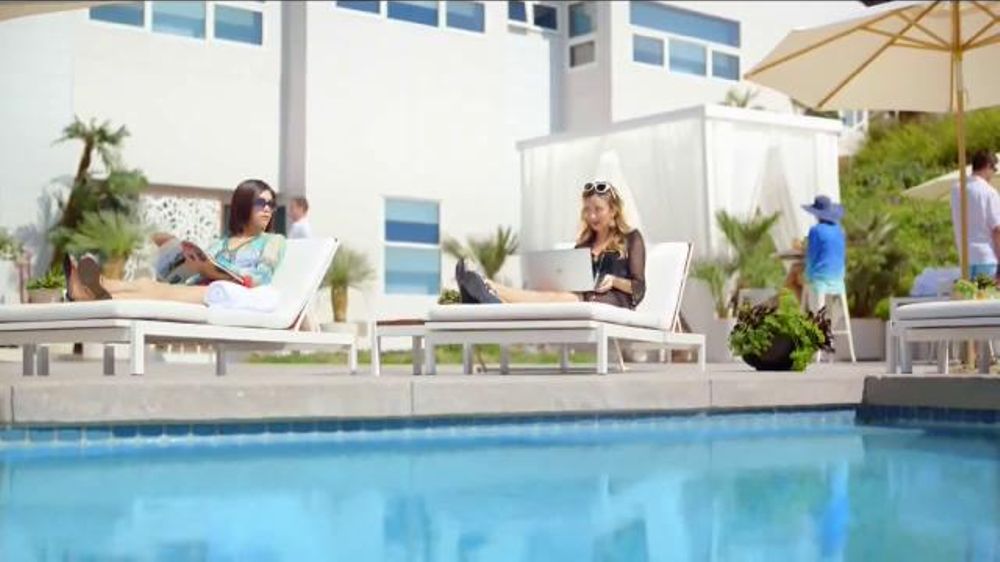
Locate an element on the screen. magazine is located at coordinates (173, 273), (201, 251).